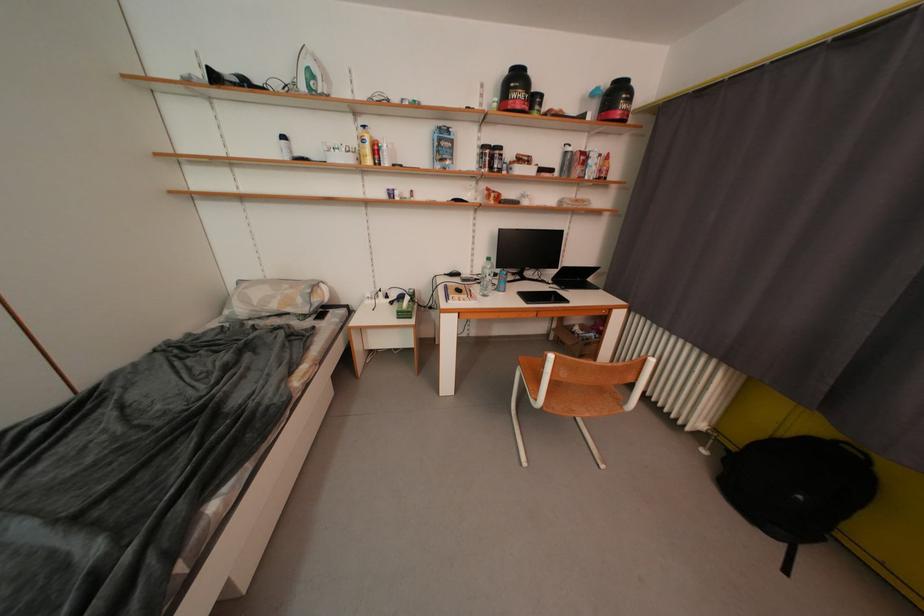
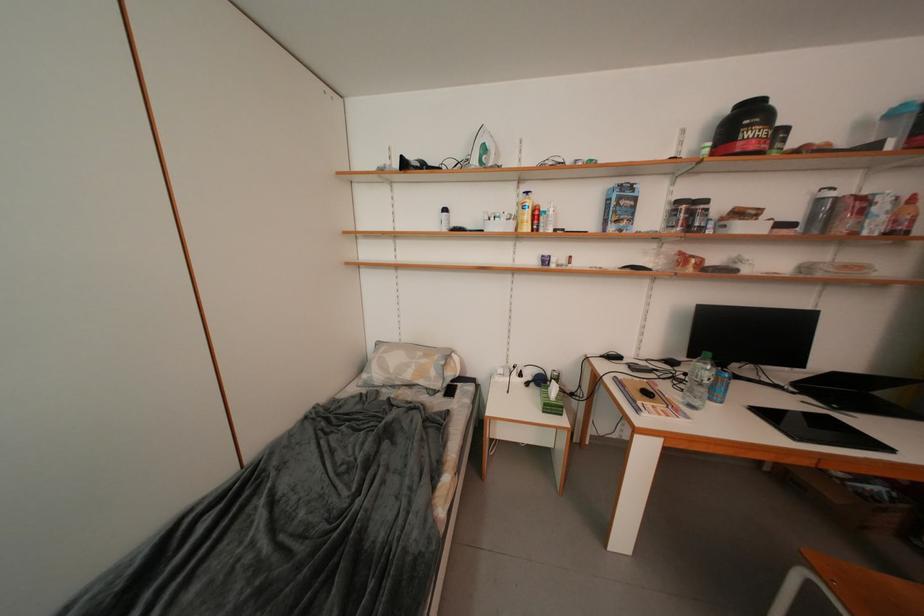
The images are taken continuously from a first-person perspective. In which direction are you moving?

The cameraman moved toward left, forward.